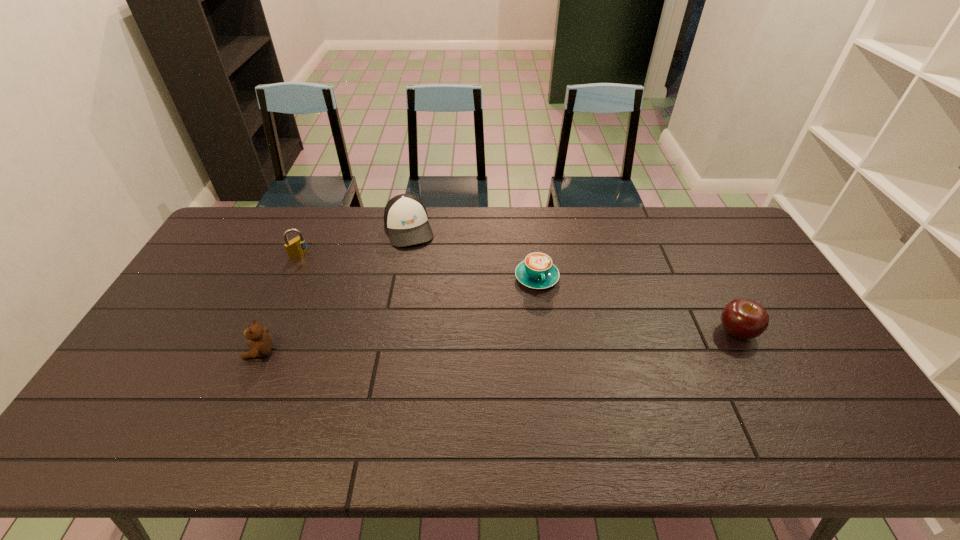
You are a GUI agent. You are given a task and a screenshot of the screen. Output one action in this format:
    pyautogui.click(x=<x>, y=<y>)
    Task: Click on the teddy bear
    
    Given the screenshot: What is the action you would take?
    pyautogui.click(x=260, y=342)

At what (x,y) coordinates should I click in order to perform the action: click on the rightmost object. Please return your answer as a coordinate pair (x, y). The width and height of the screenshot is (960, 540). Looking at the image, I should click on (744, 319).

Find the location of a particular element. padlock is located at coordinates (296, 247).

Where is `the fourth object from left to right`? The image size is (960, 540). the fourth object from left to right is located at coordinates (537, 271).

Image resolution: width=960 pixels, height=540 pixels. In order to click on cappuccino in this screenshot , I will do `click(537, 271)`.

This screenshot has height=540, width=960. What are the coordinates of `the third object from right to left` in the screenshot? It's located at (405, 217).

Image resolution: width=960 pixels, height=540 pixels. Identify the location of free space located at the face of the teddy bear. (169, 352).

What are the coordinates of `vacant area situated 0.060m at the face of the teddy bear` in the screenshot? It's located at (224, 352).

The image size is (960, 540). What are the coordinates of `blank space located at the face of the teddy bear` in the screenshot? It's located at (177, 352).

Locate an element on the screen. free region located 0.140m on the front of the rightmost object is located at coordinates (768, 393).